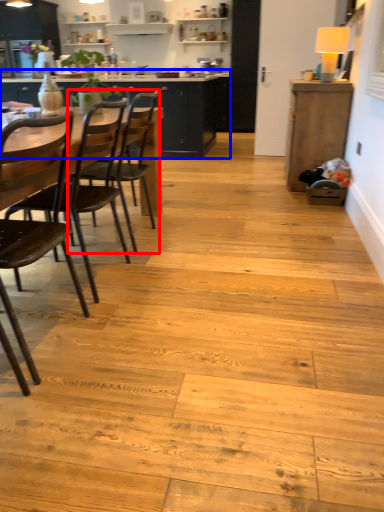
Question: Which of the following is the closest to the observer, chair (highlighted by a red box) or cabinetry (highlighted by a blue box)?

Choices:
 (A) chair
 (B) cabinetry

Answer: (A)